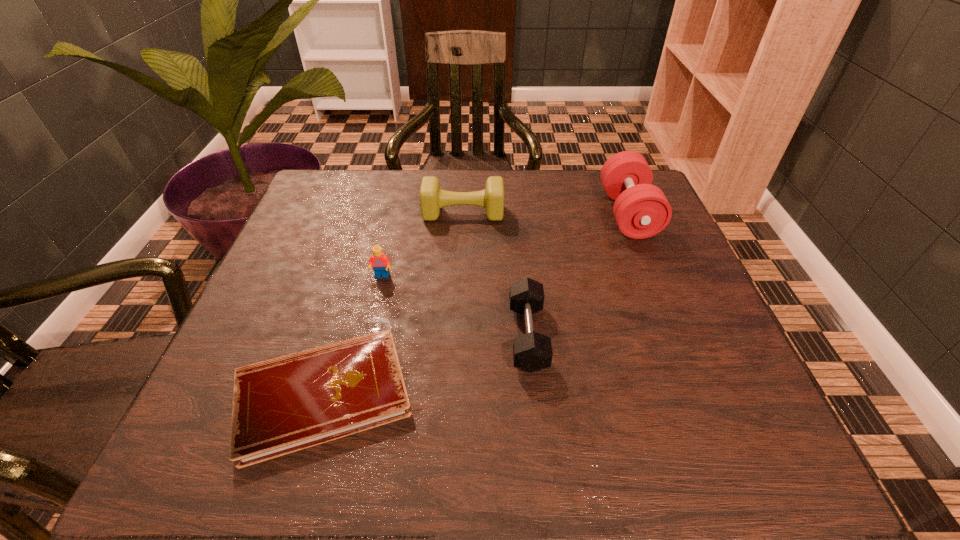
You are a GUI agent. You are given a task and a screenshot of the screen. Output one action in this format:
    pyautogui.click(x=<x>, y=<y>)
    Task: Click on the tallest dumbbell
    The image size is (960, 540).
    Given the screenshot: What is the action you would take?
    pyautogui.click(x=641, y=210)

Where is `the rightmost object`? The width and height of the screenshot is (960, 540). the rightmost object is located at coordinates (641, 210).

Where is `the leftmost dumbbell`? This screenshot has height=540, width=960. the leftmost dumbbell is located at coordinates (432, 198).

Identify the location of Lego. (380, 262).

This screenshot has height=540, width=960. I want to click on the shortest dumbbell, so click(x=532, y=351).

I want to click on the second object from right to left, so click(x=532, y=351).

Where is `notebook`? The width and height of the screenshot is (960, 540). notebook is located at coordinates (283, 405).

The image size is (960, 540). What are the coordinates of `free space located 0.390m on the left of the tallest object` in the screenshot? It's located at (451, 213).

You are a GUI agent. You are given a task and a screenshot of the screen. Output one action in this format:
    pyautogui.click(x=<x>, y=<y>)
    Task: Click on the free region located on the right of the leftmost dumbbell
    Image resolution: width=960 pixels, height=540 pixels.
    Given the screenshot: What is the action you would take?
    pyautogui.click(x=541, y=213)

Locate an element on the screen. vacant space located on the face of the Lego is located at coordinates (338, 467).